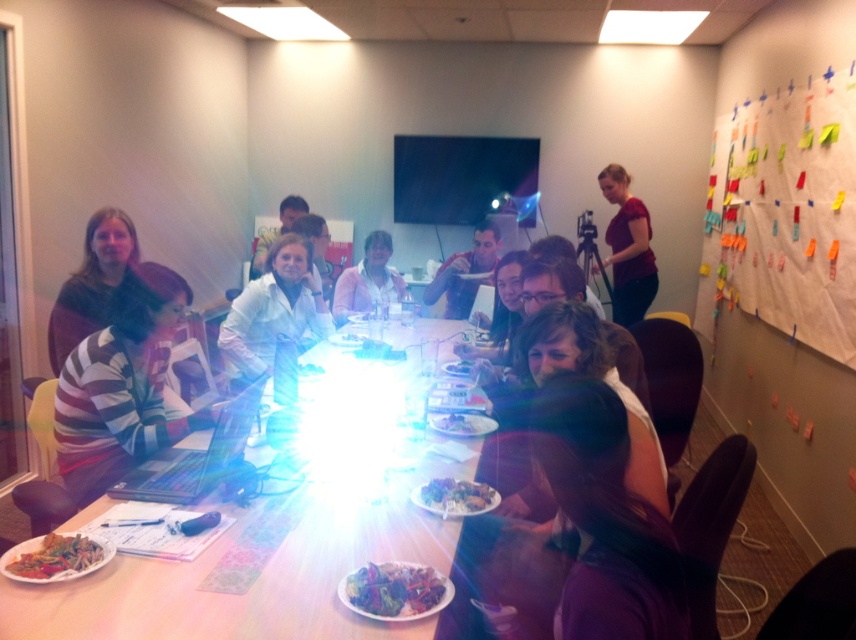
You are a photographer trying to capture a clear shot of the smooth white plate at center without any obstructions. The matte red shirt at upper right is in your way. Can you estimate whether the shirt is wide enough to block the entire plate from view?

The matte red shirt at upper right might be wider than smooth white plate at center, so there is a possibility that the shirt could block the entire plate from view depending on their exact positions.

Based on the photo, you are a photographer trying to capture a group photo of the people at the table. You want to ensure that both the matte red shirt at upper right and the matte white shirt at center are visible in the frame. Given their height difference, which shirt should you position closer to the camera to avoid one blocking the other?

The matte red shirt at upper right is much taller than the matte white shirt at center. To avoid blocking, position the shorter matte white shirt at center closer to the camera so it appears larger in the frame and doesn

You are sitting at the table and want to pass a note to the person wearing the matte red shirt at upper right. Which direction should you move the note to reach them from the matte white shirt at center?

The matte red shirt at upper right is below the matte white shirt at center, so you should move the note downward to reach them.